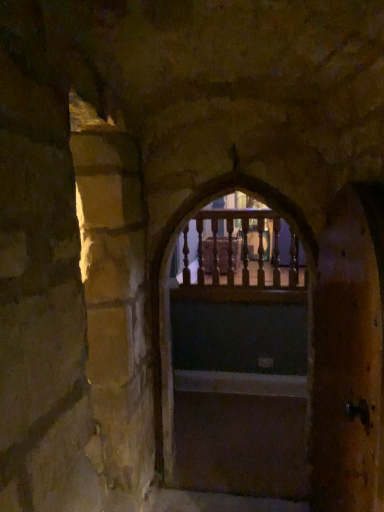
The width and height of the screenshot is (384, 512). What do you see at coordinates (236, 376) in the screenshot? I see `wooden railing at center` at bounding box center [236, 376].

In order to face wooden railing at center, should I rotate leftwards or rightwards?

To face it directly, rotate right by 5.417 degrees.

The image size is (384, 512). Find the location of `smooth wooden stairs at center`. smooth wooden stairs at center is located at coordinates (240, 433).

Is point (195, 292) positioned before point (283, 406)?

No, (195, 292) is behind (283, 406).

The width and height of the screenshot is (384, 512). What are the coordinates of `stairs in front of the wooden railing at center` in the screenshot? It's located at (240, 433).

Which object is wider, wooden railing at center or smooth wooden stairs at center?

smooth wooden stairs at center.

Is wooden railing at center looking in the opposite direction of smooth wooden stairs at center?

No, wooden railing at center's orientation is not away from smooth wooden stairs at center.

Consider the image. Is smooth wooden stairs at center taller or shorter than wooden railing at center?

Considering their sizes, smooth wooden stairs at center has less height than wooden railing at center.

In the image, there is a wooden railing at center. Find the location of `stairs below it (from a real-world perspective)`. stairs below it (from a real-world perspective) is located at coordinates (240, 433).

From the image's perspective, between smooth wooden stairs at center and wooden railing at center, who is located below?

smooth wooden stairs at center is shown below in the image.

Between smooth wooden stairs at center and wooden railing at center, which one is positioned behind?

wooden railing at center is more distant.

Considering the relative positions of wooden door at right and wooden railing at center in the image provided, is wooden door at right to the left of wooden railing at center from the viewer's perspective?

No, wooden door at right is not to the left of wooden railing at center.

Looking at their sizes, would you say wooden door at right is wider or thinner than wooden railing at center?

Considering their sizes, wooden door at right looks broader than wooden railing at center.

From the image's perspective, is wooden door at right above or below wooden railing at center?

Clearly, from the image's perspective, wooden door at right is below wooden railing at center.

Considering the sizes of objects wooden door at right and wooden railing at center in the image provided, who is shorter, wooden door at right or wooden railing at center?

Standing shorter between the two is wooden railing at center.

Is wooden railing at center inside wooden railing at center?

Definitely not — wooden railing at center is not inside wooden railing at center.

Considering the positions of objects wooden railing at center and wooden railing at center in the image provided, who is more to the right, wooden railing at center or wooden railing at center?

wooden railing at center.

Which point is more forward, (290, 246) or (218, 187)?

The point (218, 187) is closer to the camera.

From the image's perspective, is wooden railing at center on top of wooden railing at center?

Yes, from the image's perspective, wooden railing at center is on top of wooden railing at center.

From the image's perspective, which is below, wooden railing at center or wooden door at right?

wooden door at right appears lower in the image.

How distant is wooden railing at center from wooden door at right?

A distance of 6.51 feet exists between wooden railing at center and wooden door at right.

Is point (278, 196) positioned before point (321, 482)?

No.

From a real-world perspective, does wooden railing at center stand above wooden door at right?

Yes.

Is wooden railing at center positioned with its back to smooth wooden stairs at center?

Yes, wooden railing at center is facing away from smooth wooden stairs at center.

From a real-world perspective, which is physically above, wooden railing at center or smooth wooden stairs at center?

In real-world perspective, wooden railing at center is above.

Is wooden railing at center not near smooth wooden stairs at center?

wooden railing at center is actually quite close to smooth wooden stairs at center.

From the image's perspective, between wooden railing at center and smooth wooden stairs at center, which one is located above?

wooden railing at center appears higher in the image.

How far apart are wooden door at right and smooth wooden stairs at center?

The distance of wooden door at right from smooth wooden stairs at center is 4.43 feet.

Is wooden door at right taller than smooth wooden stairs at center?

Indeed, wooden door at right has a greater height compared to smooth wooden stairs at center.

Image resolution: width=384 pixels, height=512 pixels. I want to click on stairs below the wooden door at right (from the image's perspective), so click(x=240, y=433).

From a real-world perspective, is wooden door at right physically below smooth wooden stairs at center?

Actually, wooden door at right is physically above smooth wooden stairs at center in the real world.

Identify the location of window that is behind the smooth wooden stairs at center. This screenshot has width=384, height=512. (248, 251).

This screenshot has height=512, width=384. Identify the location of stairs below the wooden railing at center (from the image's perspective). (240, 433).

Estimate the real-world distances between objects in this image. Which object is closer to smooth wooden stairs at center, wooden railing at center or wooden door at right?

The object closer to smooth wooden stairs at center is wooden railing at center.

Estimate the real-world distances between objects in this image. Which object is closer to wooden railing at center, smooth wooden stairs at center or wooden railing at center?

Based on the image, smooth wooden stairs at center appears to be nearer to wooden railing at center.

Based on the photo, considering their positions, is wooden railing at center positioned closer to smooth wooden stairs at center than wooden door at right?

wooden railing at center is closer to smooth wooden stairs at center.

Looking at the image, which one is located closer to wooden railing at center, wooden railing at center or smooth wooden stairs at center?

Among the two, smooth wooden stairs at center is located nearer to wooden railing at center.

Looking at the image, which one is located closer to wooden railing at center, wooden door at right or wooden railing at center?

Based on the image, wooden railing at center appears to be nearer to wooden railing at center.

Based on their spatial positions, is wooden door at right or wooden railing at center further from smooth wooden stairs at center?

wooden door at right lies further to smooth wooden stairs at center than the other object.

Which object lies nearer to the anchor point wooden door at right, smooth wooden stairs at center or wooden railing at center?

smooth wooden stairs at center.

Looking at the image, which one is located further to wooden door at right, wooden railing at center or wooden railing at center?

wooden railing at center is positioned further to the anchor wooden door at right.

The image size is (384, 512). I want to click on archway between wooden door at right and smooth wooden stairs at center in the front-back direction, so click(236, 376).

This screenshot has width=384, height=512. Identify the location of archway between wooden door at right and wooden railing at center from front to back. (236, 376).

You are a GUI agent. You are given a task and a screenshot of the screen. Output one action in this format:
    pyautogui.click(x=<x>, y=<y>)
    Task: Click on the stairs between wooden door at right and wooden railing at center from front to back
    
    Given the screenshot: What is the action you would take?
    pyautogui.click(x=240, y=433)

Where is `stairs positioned between wooden railing at center and wooden railing at center from near to far`? This screenshot has height=512, width=384. stairs positioned between wooden railing at center and wooden railing at center from near to far is located at coordinates (240, 433).